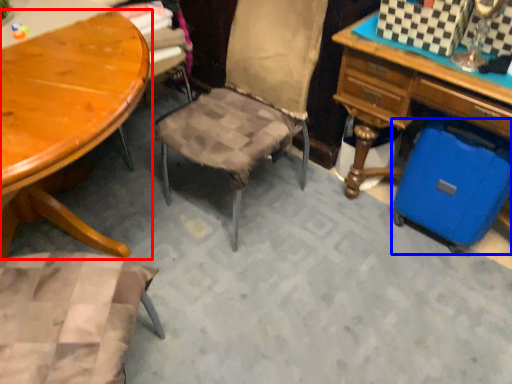
Question: Among these objects, which one is farthest to the camera, table (highlighted by a red box) or luggage (highlighted by a blue box)?

Choices:
 (A) table
 (B) luggage

Answer: (B)